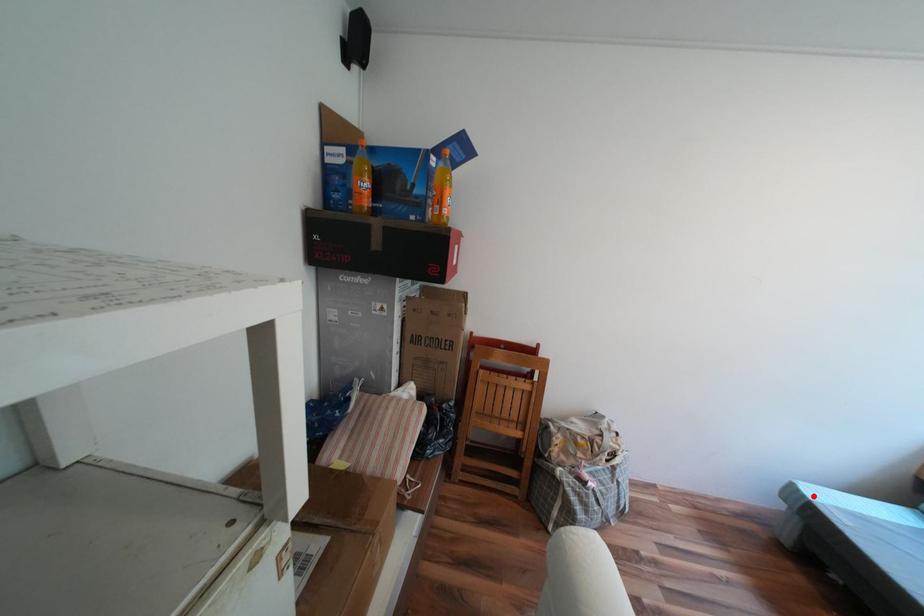
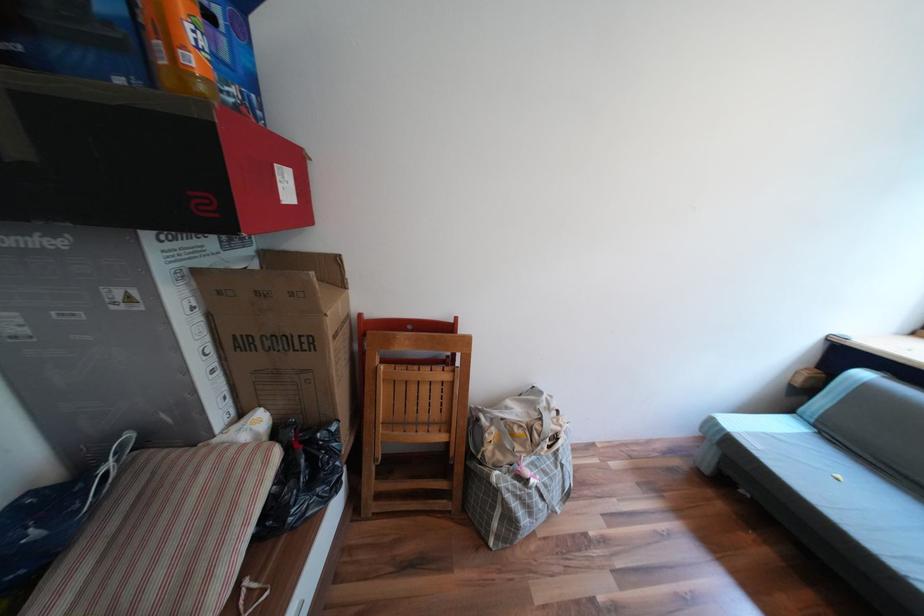
Locate, in the second image, the point that corresponds to the highlighted location in the first image.

(733, 428)